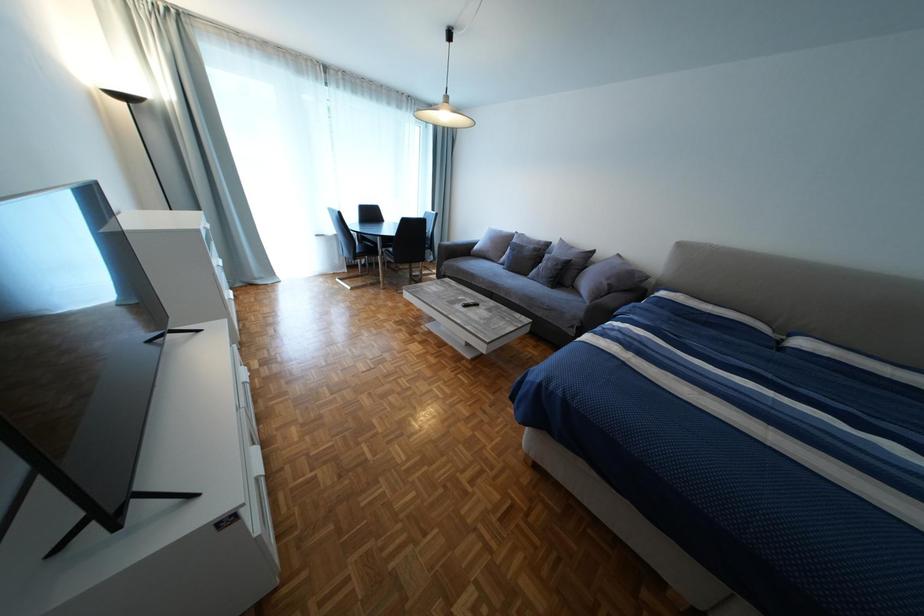
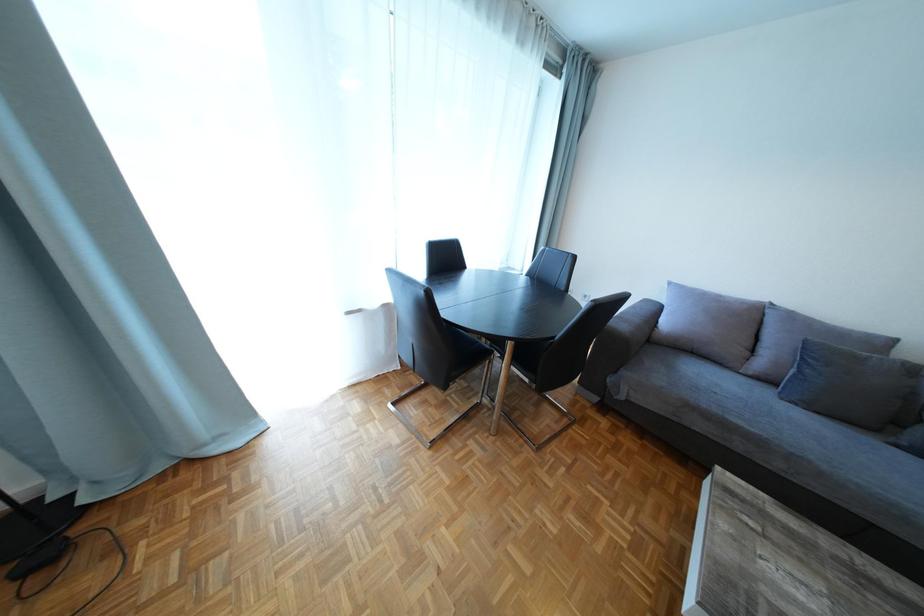
What movement of the cameraman would produce the second image?

The movement direction of the cameraman is left, forward.